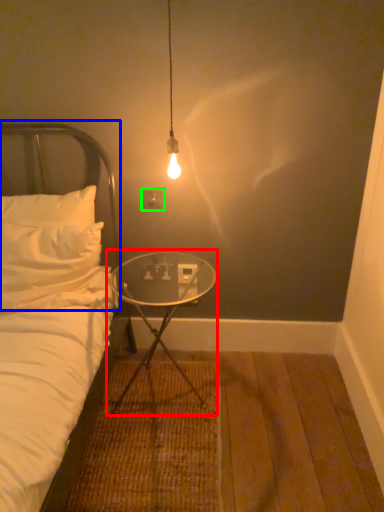
Question: Which object is the closest to the table (highlighted by a red box)? Choose among these: headboard (highlighted by a blue box) or electric outlet (highlighted by a green box).

Choices:
 (A) headboard
 (B) electric outlet

Answer: (B)